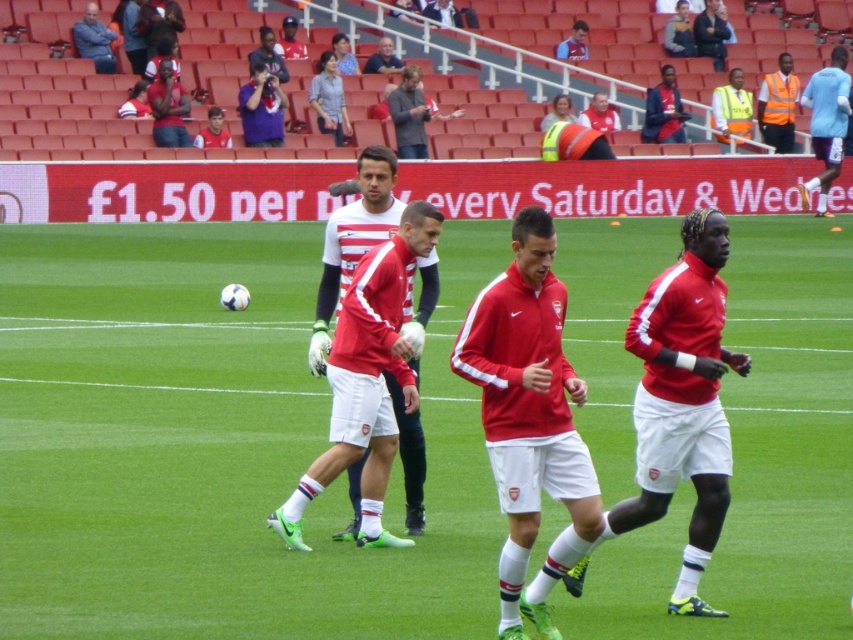
Question: Based on their relative distances, which object is farther from the dark gray jacket at upper left?

Choices:
 (A) reflective yellow vest at upper right
 (B) high visibility vest at upper right

Answer: (B)

Question: Which point is farther from the camera taking this photo?

Choices:
 (A) (177, 129)
 (B) (13, 550)
 (C) (699, 561)

Answer: (A)

Question: Where is high visibility vest at upper right located in relation to reflective yellow vest at upper right in the image?

Choices:
 (A) below
 (B) above

Answer: (B)

Question: Is green grass football field at center positioned at the back of high visibility vest at upper right?

Choices:
 (A) no
 (B) yes

Answer: (A)

Question: Based on their relative distances, which object is farther from the green grass football field at center?

Choices:
 (A) matte red shirt at upper left
 (B) high visibility vest at upper right
 (C) matte red jersey at center

Answer: (B)

Question: Is green grass football field at center to the left of matte red shirt at upper left from the viewer's perspective?

Choices:
 (A) no
 (B) yes

Answer: (A)